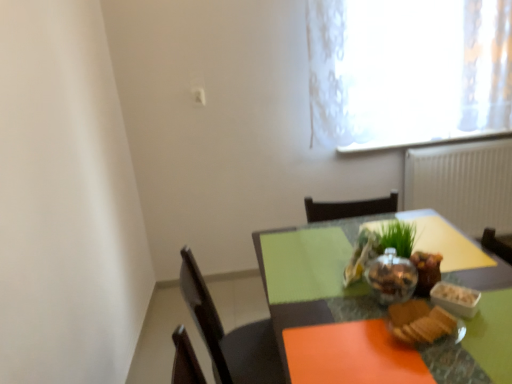
Locate an element on the screen. This screenshot has height=384, width=512. free location above green glass table at center (from a real-world perspective) is located at coordinates (369, 286).